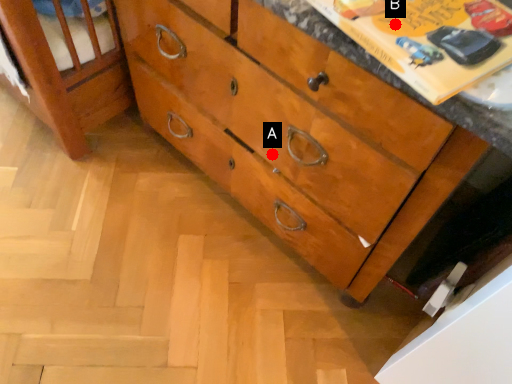
Question: Two points are circled on the image, labeled by A and B beside each circle. Among these points, which one is farthest from the camera?

Choices:
 (A) A is further
 (B) B is further

Answer: (A)